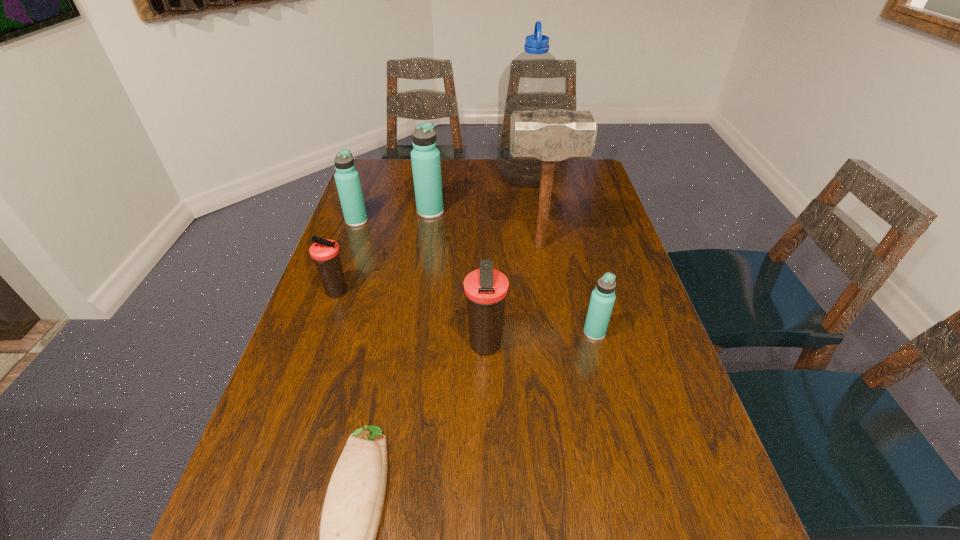
Locate an element on the screen. Image resolution: width=960 pixels, height=540 pixels. the farthest object is located at coordinates (534, 80).

Locate an element on the screen. water jug is located at coordinates (534, 80).

This screenshot has width=960, height=540. I want to click on mallet, so click(x=550, y=135).

In order to click on the seventh shortest object in this screenshot , I will do `click(550, 135)`.

Where is `the third tallest object`? Image resolution: width=960 pixels, height=540 pixels. the third tallest object is located at coordinates (425, 157).

Find the location of a particular element. This screenshot has width=960, height=540. the second aqua thermos bottle from right to left is located at coordinates (425, 157).

Locate an element on the screen. The image size is (960, 540). the bigger brown thermos bottle is located at coordinates (486, 289).

Locate an element on the screen. This screenshot has width=960, height=540. the right brown thermos bottle is located at coordinates (486, 289).

Find the location of a particular element. Image resolution: width=960 pixels, height=540 pixels. the second smallest aqua thermos bottle is located at coordinates (347, 179).

Locate an element on the screen. the left brown thermos bottle is located at coordinates (325, 253).